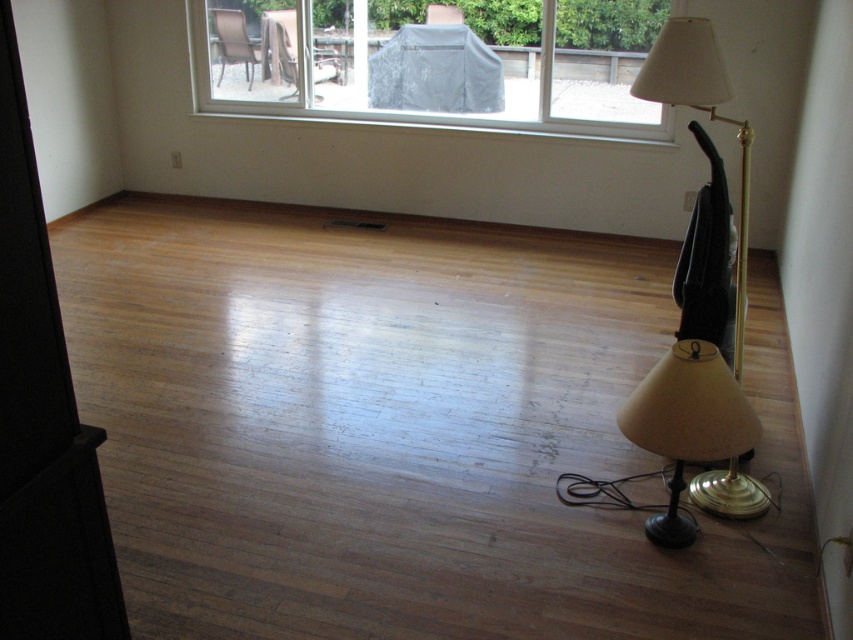
You are standing in the room and want to move from the brown woven chair at upper left to the matte gold lampshade at lower right. Which direction should you move to reach it?

You should move to the right to reach the matte gold lampshade at lower right from the brown woven chair at upper left because the matte gold lampshade at lower right is located to the right of the brown woven chair at upper left.